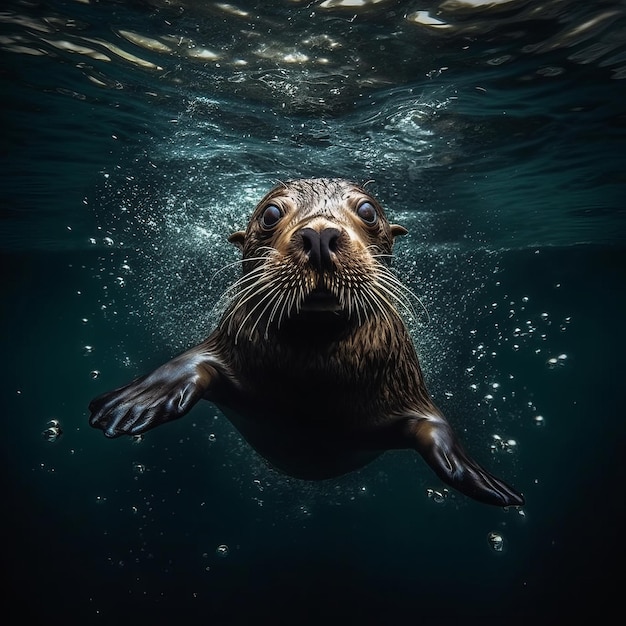
Locate an element on the screen. The width and height of the screenshot is (626, 626). surface is located at coordinates [x=312, y=118].